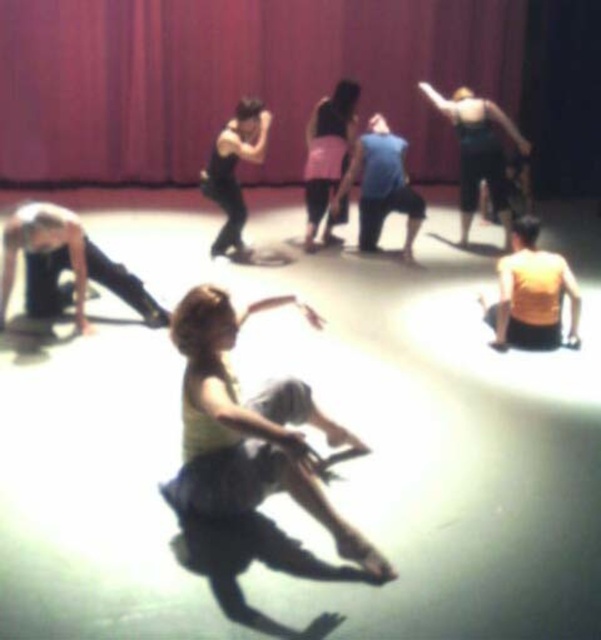
You are standing at the center of the studio floor. There is a point marked at coordinates (532, 294). Which object is this point located on?

The point is located on the yellow matte tank top at lower right.

You are a stagehand preparing to set up a performance. You need to place a new spotlight that should be positioned to the right of the pink fabric skirt at center. According to the current setup, where would this spotlight be in relation to the matte red curtain at upper center?

The matte red curtain at upper center is to the left of the pink fabric skirt at center. Placing the spotlight to the right of the pink fabric skirt at center would position it further to the right of the matte red curtain at upper center.

You are a photographer setting up for a photoshoot in the studio. You want to position a spotlight so that it illuminates both the matte yellow tank top at center and the green fabric dress at upper right without casting shadows over the red curtain. Based on their positions, where should you aim the spotlight?

The spotlight should be aimed above the green fabric dress at upper right since the matte yellow tank top at center is below it, allowing the light to reach both objects without casting shadows on the red curtain.